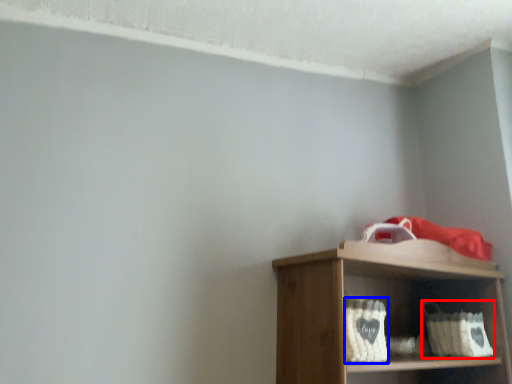
Question: Among these objects, which one is nearest to the camera, basket (highlighted by a red box) or basket (highlighted by a blue box)?

Choices:
 (A) basket
 (B) basket

Answer: (B)